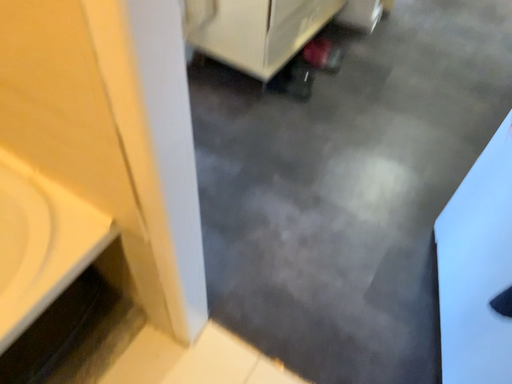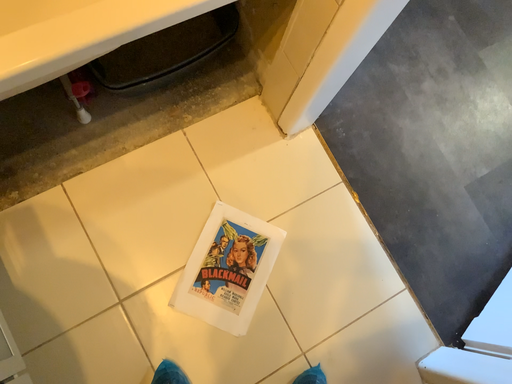
Question: Which way did the camera rotate in the video?

Choices:
 (A) rotated upward
 (B) rotated downward

Answer: (B)